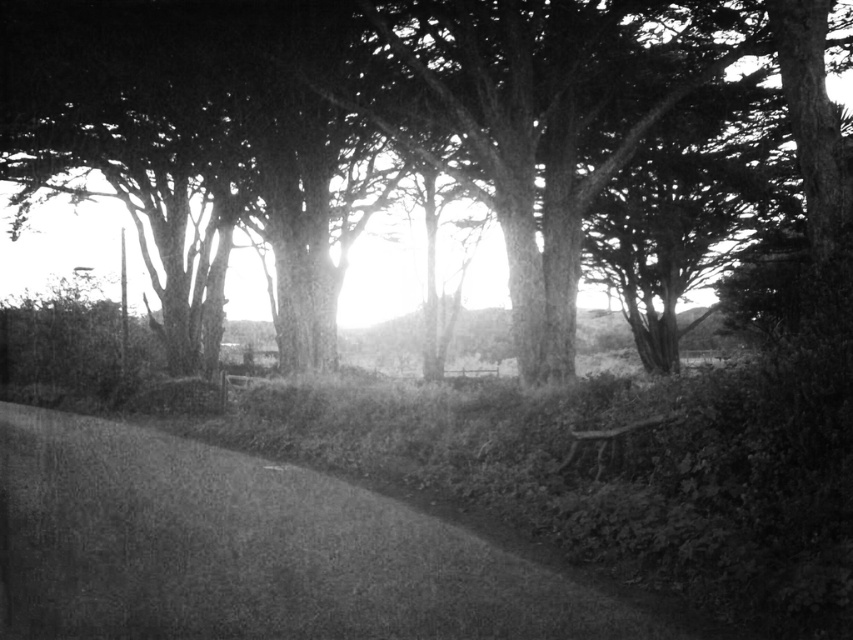
Question: Is the position of gravelly path at center less distant than that of smooth bark tree at center?

Choices:
 (A) yes
 (B) no

Answer: (A)

Question: In this image, where is smooth bark tree at center located relative to wooden park bench at lower right?

Choices:
 (A) below
 (B) above

Answer: (B)

Question: Can you confirm if gravelly path at center is smaller than wooden park bench at lower right?

Choices:
 (A) no
 (B) yes

Answer: (A)

Question: Which point is closer to the camera taking this photo?

Choices:
 (A) (165, 472)
 (B) (343, 8)
 (C) (572, 440)

Answer: (C)

Question: Based on their relative distances, which object is farther from the gravelly path at center?

Choices:
 (A) smooth bark tree at center
 (B) wooden park bench at lower right

Answer: (A)

Question: Which object is positioned farthest from the smooth bark tree at center?

Choices:
 (A) wooden park bench at lower right
 (B) gravelly path at center

Answer: (B)